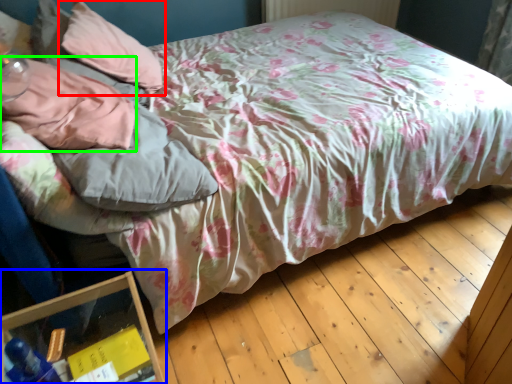
Question: Based on their relative distances, which object is farther from pillow (highlighted by a red box)? Choose from glass box (highlighted by a blue box) and pillow (highlighted by a green box).

Choices:
 (A) glass box
 (B) pillow

Answer: (A)